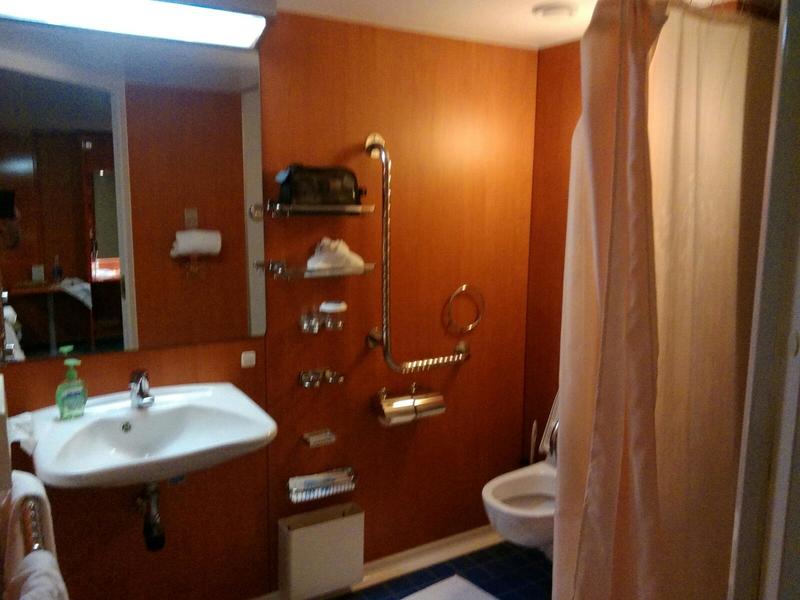
Locate an element on the screen. The height and width of the screenshot is (600, 800). chrome mixer basin tap is located at coordinates (141, 388).